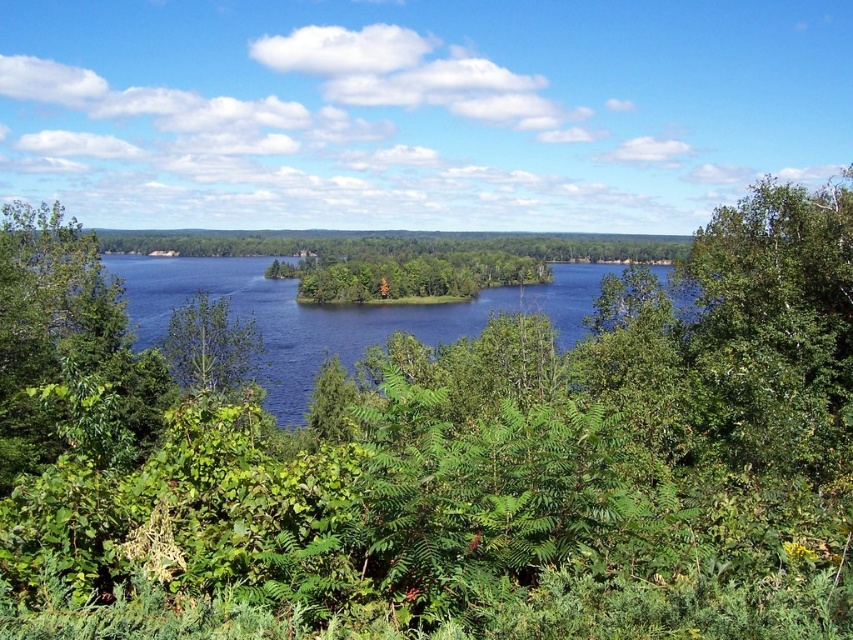
Question: Which object is closer to the camera taking this photo?

Choices:
 (A) green leafy tree at left
 (B) green leafy tree at center

Answer: (A)

Question: Considering the relative positions of blue water at center and green leafy tree at center in the image provided, where is blue water at center located with respect to green leafy tree at center?

Choices:
 (A) right
 (B) left

Answer: (A)

Question: Considering the real-world distances, which object is closest to the blue water at center?

Choices:
 (A) green leafy tree at left
 (B) green leafy tree at center

Answer: (B)

Question: Can you confirm if blue water at center is positioned above green leafy tree at center?

Choices:
 (A) no
 (B) yes

Answer: (B)

Question: Is blue water at center further to camera compared to green leafy tree at center?

Choices:
 (A) yes
 (B) no

Answer: (A)

Question: Which of the following is the farthest from the observer?

Choices:
 (A) (587, 280)
 (B) (24, 236)
 (C) (178, 320)

Answer: (A)